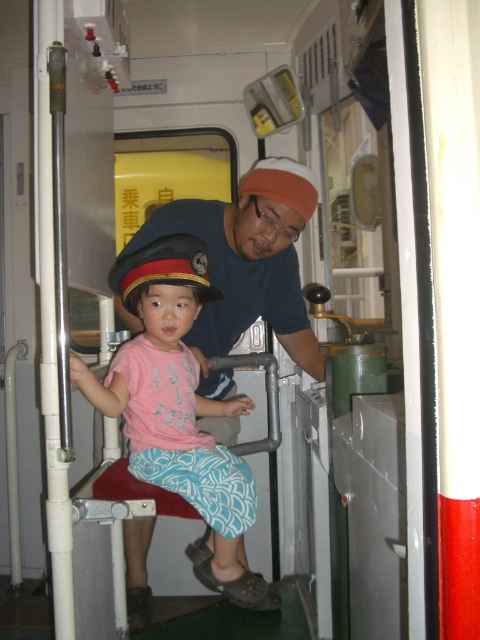
Based on the photo, does pink fabric shirt at center come in front of orange knit cap at upper center?

Yes, pink fabric shirt at center is closer to the viewer.

Is pink fabric shirt at center smaller than orange knit cap at upper center?

Incorrect, pink fabric shirt at center is not smaller in size than orange knit cap at upper center.

Is point (131, 390) more distant than point (304, 186)?

No.

I want to click on pink fabric shirt at center, so [179, 410].

The image size is (480, 640). I want to click on black felt hat at center, so click(164, 269).

Does pink fabric shirt at center have a lesser height compared to black felt hat at center?

In fact, pink fabric shirt at center may be taller than black felt hat at center.

Locate an element on the screen. The image size is (480, 640). pink fabric shirt at center is located at coordinates (179, 410).